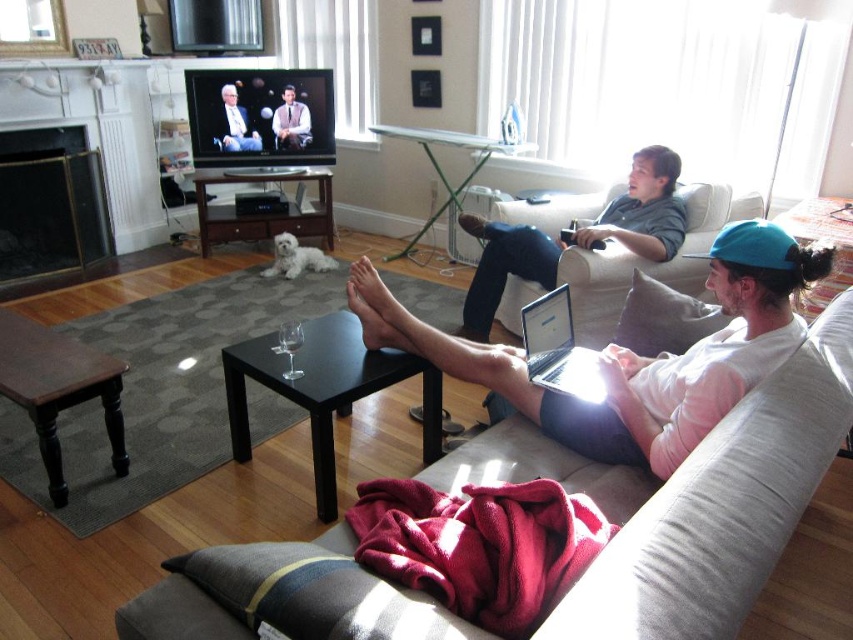
Can you confirm if gray fabric couch at lower right is positioned below smooth black suit at center?

Correct, gray fabric couch at lower right is located below smooth black suit at center.

Which is below, gray fabric couch at lower right or smooth black suit at center?

gray fabric couch at lower right is lower down.

Is point (734, 554) positioned in front of point (223, 104)?

Yes, it is.

Image resolution: width=853 pixels, height=640 pixels. I want to click on gray fabric couch at lower right, so click(689, 500).

Who is more distant from viewer, (816,477) or (532,353)?

The point (532,353) is more distant.

In the scene shown: Can you confirm if gray fabric couch at lower right is thinner than silver metallic laptop at center?

No, gray fabric couch at lower right is not thinner than silver metallic laptop at center.

What do you see at coordinates (689, 500) in the screenshot? I see `gray fabric couch at lower right` at bounding box center [689, 500].

Where is `gray fabric couch at lower right`? This screenshot has width=853, height=640. gray fabric couch at lower right is located at coordinates (689, 500).

Measure the distance between point (752,396) and camera.

Point (752,396) is 4.59 feet from camera.

Looking at this image, does gray fabric couch at lower right have a larger size compared to black metal fireplace at left?

Correct, gray fabric couch at lower right is larger in size than black metal fireplace at left.

Where is `gray fabric couch at lower right`? The width and height of the screenshot is (853, 640). gray fabric couch at lower right is located at coordinates (689, 500).

Find the location of a particular element. Image resolution: width=853 pixels, height=640 pixels. gray fabric couch at lower right is located at coordinates click(689, 500).